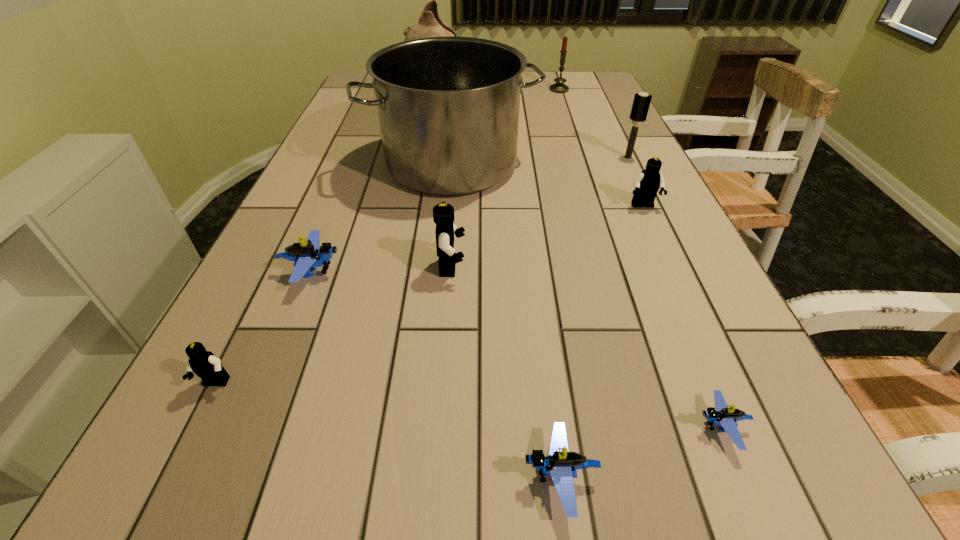
At what (x,y) coordinates should I click in order to perform the action: click on vacant area located on the left of the red candle. Please return your answer as a coordinate pair (x, y). The width and height of the screenshot is (960, 540). Looking at the image, I should click on click(x=500, y=90).

Where is `vacant point located on the front-facing side of the second black Lego from right to left`? The width and height of the screenshot is (960, 540). vacant point located on the front-facing side of the second black Lego from right to left is located at coordinates (601, 267).

At what (x,y) coordinates should I click in order to perform the action: click on vacant area situated on the front-facing side of the fifth shortest object. Please return your answer as a coordinate pair (x, y). Image resolution: width=960 pixels, height=540 pixels. Looking at the image, I should click on (700, 330).

Identify the location of vacant space situated on the front-facing side of the farthest blue Lego. The width and height of the screenshot is (960, 540). tap(465, 271).

Where is `vacant region located 0.050m on the front-facing side of the third nearest object`? The height and width of the screenshot is (540, 960). vacant region located 0.050m on the front-facing side of the third nearest object is located at coordinates (196, 423).

Image resolution: width=960 pixels, height=540 pixels. I want to click on vacant position located 0.340m on the front-facing side of the second biggest blue Lego, so click(268, 477).

You are a GUI agent. You are given a task and a screenshot of the screen. Output one action in this format:
    pyautogui.click(x=<x>, y=<y>)
    Task: Click on the vacant space situated on the front-facing side of the second biggest blue Lego
    The image size is (960, 540).
    Given the screenshot: What is the action you would take?
    pyautogui.click(x=372, y=477)

This screenshot has height=540, width=960. Identify the location of vacant position located 0.070m on the front-facing side of the second biggest blue Lego. (470, 477).

Where is `vacant space located 0.270m on the front-facing side of the shortest Lego`? This screenshot has height=540, width=960. vacant space located 0.270m on the front-facing side of the shortest Lego is located at coordinates [x=509, y=428].

Image resolution: width=960 pixels, height=540 pixels. In order to click on vacant region located on the front-facing side of the shortest Lego in this screenshot , I will do `click(599, 428)`.